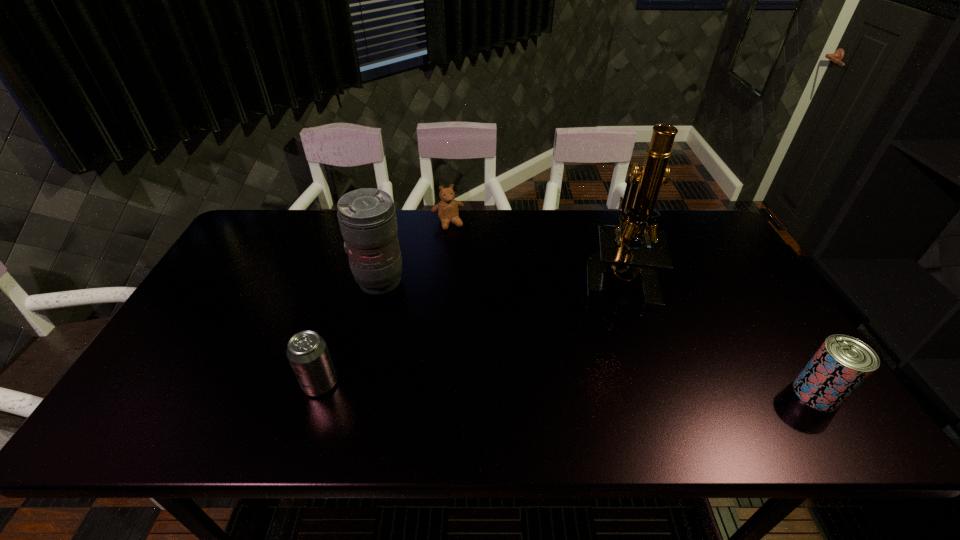
The height and width of the screenshot is (540, 960). Find the location of `blank space located at the eyepiece of the microscope`. blank space located at the eyepiece of the microscope is located at coordinates (583, 344).

This screenshot has height=540, width=960. In order to click on free space located at the eyepiece of the microscope in this screenshot , I will do `click(597, 320)`.

At what (x,y) coordinates should I click in order to perform the action: click on free location located 0.390m on the side of the second tallest object where the control switches are located. Please return your answer as a coordinate pair (x, y). This screenshot has width=960, height=540. Looking at the image, I should click on (492, 375).

I want to click on vacant point located 0.380m on the side of the second tallest object where the control switches are located, so click(490, 372).

I want to click on vacant space located on the side of the second tallest object where the control switches are located, so click(x=428, y=321).

Where is `vacant space situated on the face of the teddy bear`? This screenshot has height=540, width=960. vacant space situated on the face of the teddy bear is located at coordinates (491, 308).

In order to click on vacant point located 0.270m on the face of the teddy bear in this screenshot , I will do `click(478, 282)`.

I want to click on free region located 0.080m on the face of the teddy bear, so click(459, 245).

At what (x,y) coordinates should I click in order to perform the action: click on microscope present at the far edge. Please return your answer as a coordinate pair (x, y). The height and width of the screenshot is (540, 960). Looking at the image, I should click on pyautogui.click(x=616, y=254).

Identify the location of teddy bear that is at the far edge. (447, 209).